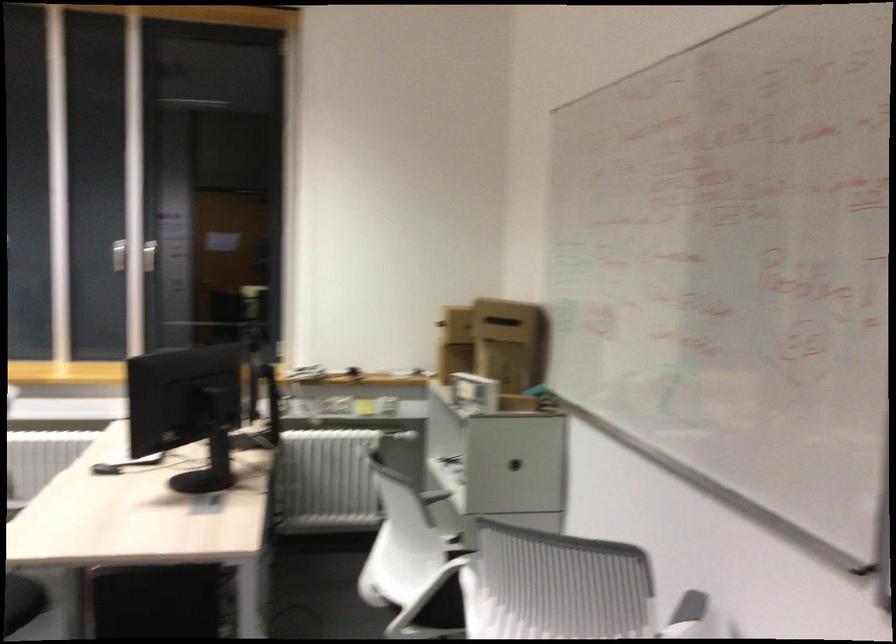
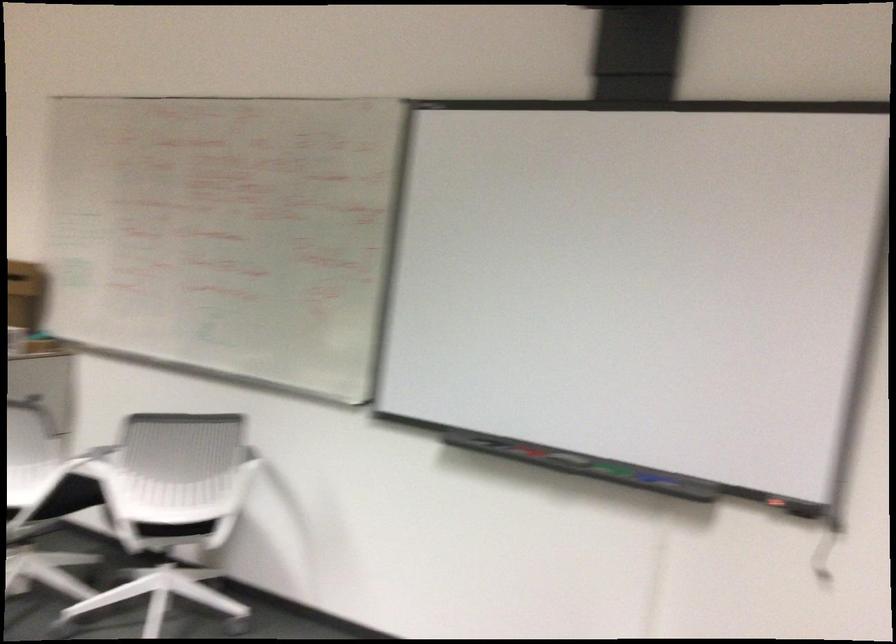
The point at (487, 558) is marked in the first image. Where is the corresponding point in the second image?

(95, 460)